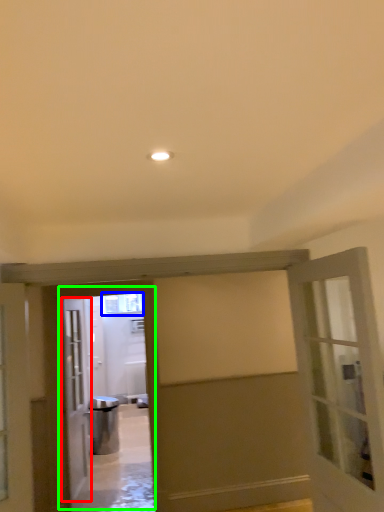
Question: Which is farther away from door (highlighted by a red box)? window (highlighted by a blue box) or elevator (highlighted by a green box)?

Choices:
 (A) window
 (B) elevator

Answer: (A)